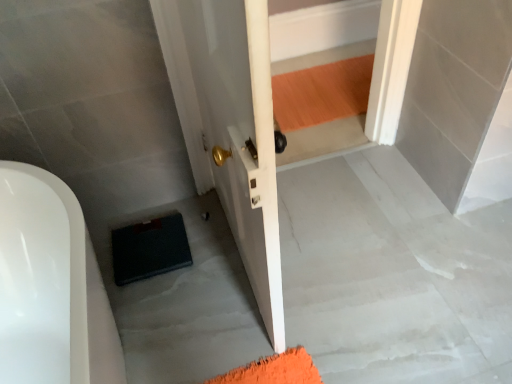
Locate an element on the screen. The width and height of the screenshot is (512, 384). vacant space in front of dark blue rubber mat at lower left is located at coordinates (x=163, y=308).